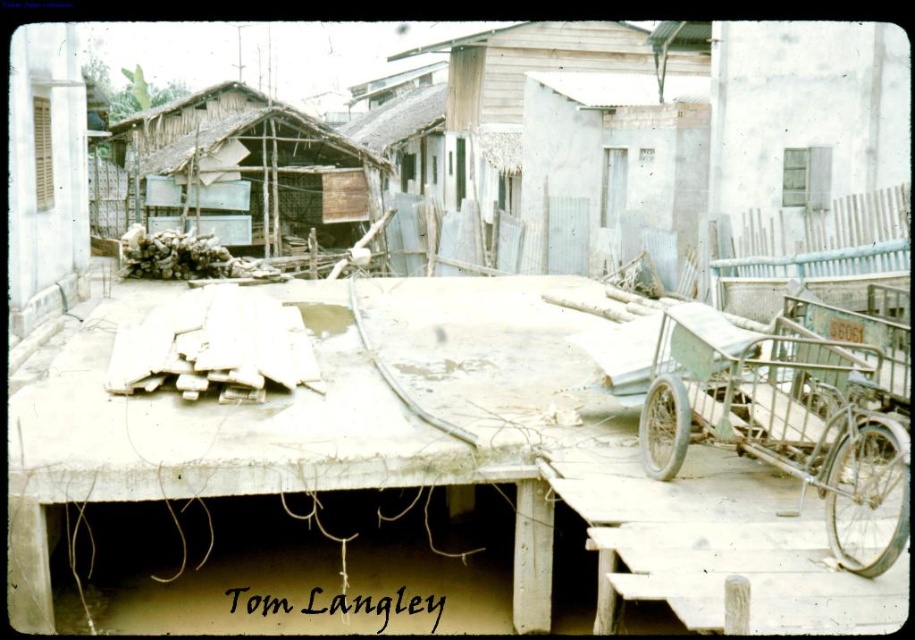
Looking at this image, can you confirm if green metallic wagon at right is shorter than wooden planks at center?

Correct, green metallic wagon at right is not as tall as wooden planks at center.

Is point (690, 349) more distant than point (261, 157)?

No, (690, 349) is closer to viewer.

Which is behind, point (849, 422) or point (194, 204)?

Positioned behind is point (194, 204).

Where is `green metallic wagon at right`? The image size is (915, 640). green metallic wagon at right is located at coordinates (788, 406).